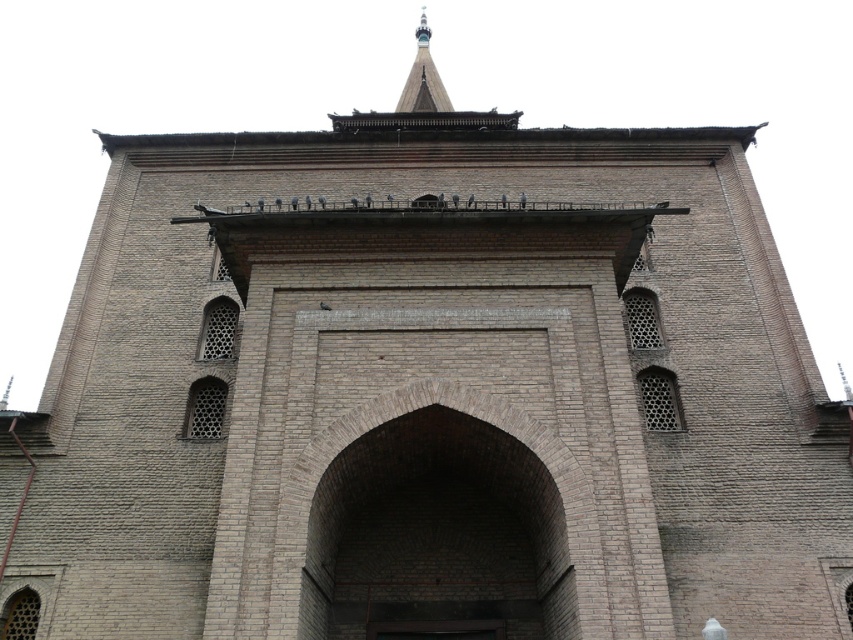
Question: Is brick archway at center bigger than shiny silver spire at upper center?

Choices:
 (A) yes
 (B) no

Answer: (B)

Question: Which of the following is the farthest from the observer?

Choices:
 (A) (550, 602)
 (B) (416, 36)

Answer: (B)

Question: In this image, where is brick archway at center located relative to shiny silver spire at upper center?

Choices:
 (A) above
 (B) below

Answer: (B)

Question: Which of the following is the closest to the observer?

Choices:
 (A) shiny silver spire at upper center
 (B) brick archway at center

Answer: (B)

Question: Does brick archway at center appear on the left side of shiny silver spire at upper center?

Choices:
 (A) yes
 (B) no

Answer: (B)